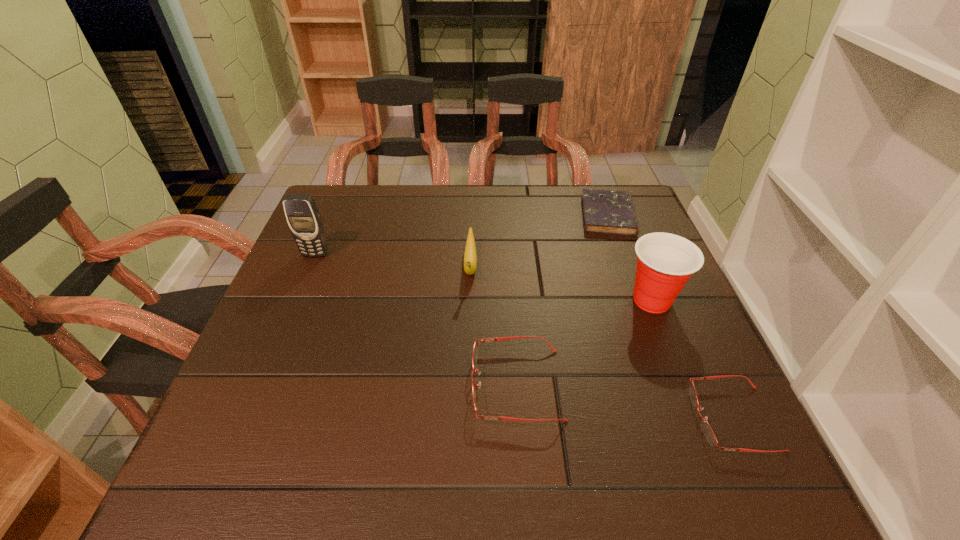
In order to click on the taller spectacles in this screenshot , I will do `click(475, 348)`.

Find the location of a particular element. The image size is (960, 540). the third shortest object is located at coordinates (475, 348).

At what (x,y) coordinates should I click in order to perform the action: click on the right spectacles. Please return your answer as a coordinate pair (x, y). Looking at the image, I should click on click(x=707, y=430).

In order to click on the shorter spectacles in this screenshot , I will do `click(707, 430)`.

You are a GUI agent. You are given a task and a screenshot of the screen. Output one action in this format:
    pyautogui.click(x=<x>, y=<y>)
    Task: Click on the shortest object
    
    Given the screenshot: What is the action you would take?
    604,211

Locate an element on the screen. This screenshot has height=540, width=960. the farthest object is located at coordinates (604, 211).

Identify the location of the fourth shortest object. The image size is (960, 540). (470, 256).

Where is `the leftmost object`? Image resolution: width=960 pixels, height=540 pixels. the leftmost object is located at coordinates (303, 217).

I want to click on the tallest object, so click(x=303, y=217).

I want to click on the fifth shortest object, so click(665, 261).